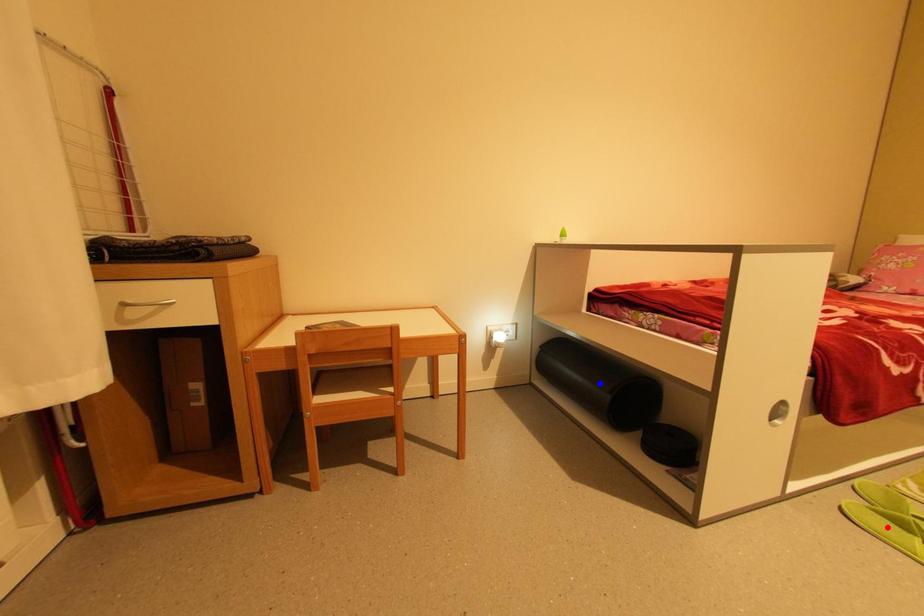
Question: Which of the two points in the image is closer to the camera?

Choices:
 (A) Blue point is closer.
 (B) Red point is closer.

Answer: (B)